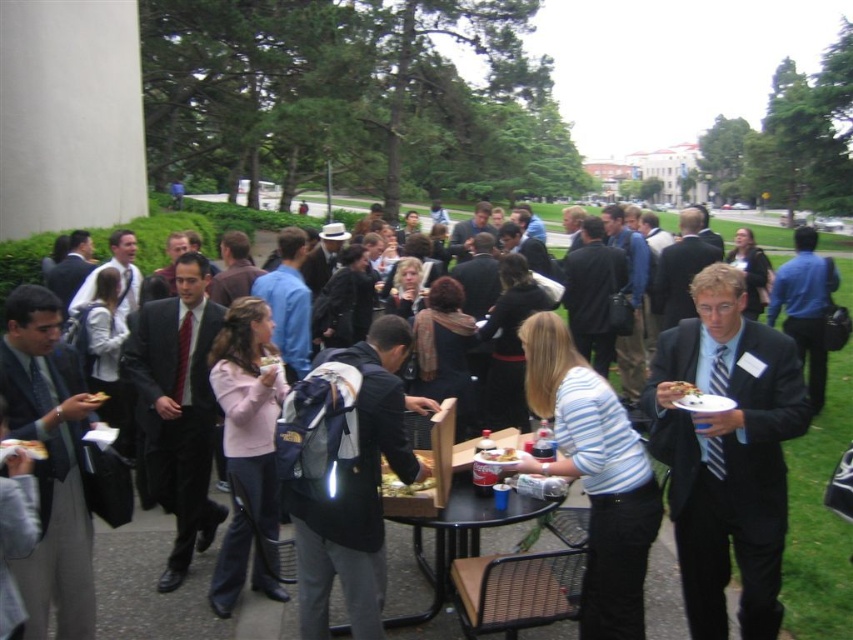
Question: Which point is closer to the camera?

Choices:
 (A) (488, 458)
 (B) (676, 381)
 (C) (589, 381)
 (D) (357, 598)

Answer: (C)

Question: Which of these objects is positioned farthest from the matte black suit at right?

Choices:
 (A) smooth cardboard pizza at center
 (B) dark gray backpack at center
 (C) black plastic table at center
 (D) striped cotton shirt at center

Answer: (B)

Question: Does dark gray backpack at center have a larger size compared to yellow bread at center?

Choices:
 (A) no
 (B) yes

Answer: (B)

Question: Which point appears closest to the camera in this image?

Choices:
 (A) (688, 392)
 (B) (642, 492)

Answer: (A)

Question: Is matte black suit at right smaller than smooth cardboard pizza at center?

Choices:
 (A) no
 (B) yes

Answer: (A)

Question: Is the position of dark gray backpack at center less distant than that of smooth cardboard pizza at center?

Choices:
 (A) no
 (B) yes

Answer: (B)